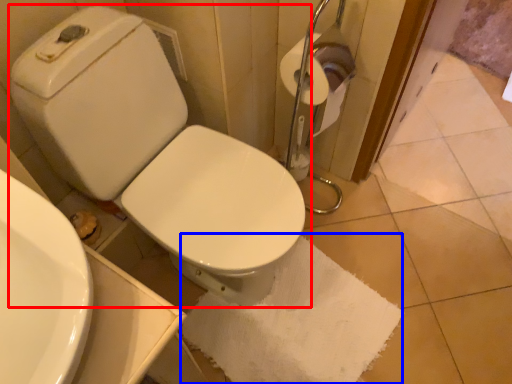
Question: Among these objects, which one is nearest to the camera, toilet (highlighted by a red box) or bath towel (highlighted by a blue box)?

Choices:
 (A) toilet
 (B) bath towel

Answer: (A)